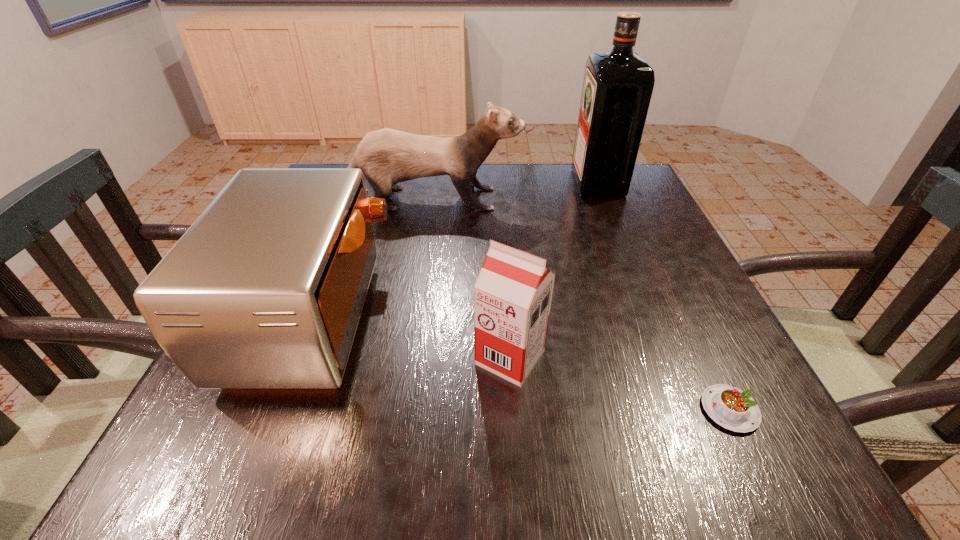
Find the location of `free spot located on the door side of the toaster oven`. free spot located on the door side of the toaster oven is located at coordinates (586, 315).

Find the location of a particular element. This screenshot has width=960, height=540. vacant space situated 0.190m on the back of the shortest object is located at coordinates (679, 303).

Identify the location of liquor situated at the far edge. This screenshot has width=960, height=540. (617, 88).

At what (x,y) coordinates should I click in order to perform the action: click on ferret present at the far edge. Please return your answer as a coordinate pair (x, y). Looking at the image, I should click on (386, 157).

Where is `object that is at the near edge`? Image resolution: width=960 pixels, height=540 pixels. object that is at the near edge is located at coordinates (733, 409).

I want to click on ferret that is at the left edge, so pos(386,157).

Identify the location of toaster oven located in the left edge section of the desktop. (265, 290).

This screenshot has height=540, width=960. What are the coordinates of `liquor that is at the right edge` in the screenshot? It's located at (617, 88).

Where is `pudding that is positioned at the right edge`? The image size is (960, 540). pudding that is positioned at the right edge is located at coordinates coord(733,409).

Locate an element on the screen. Image resolution: width=960 pixels, height=540 pixels. object positioned at the far left corner is located at coordinates (386, 157).